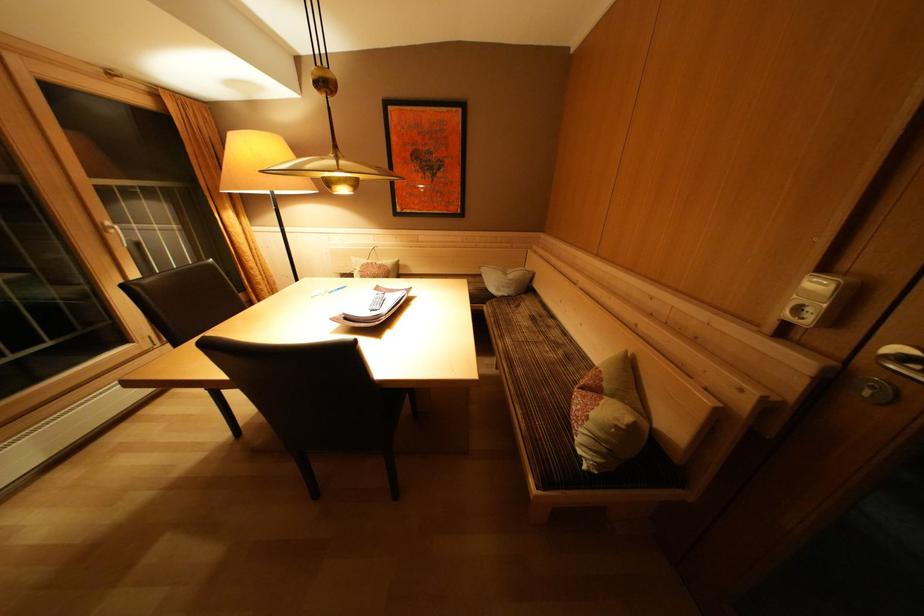
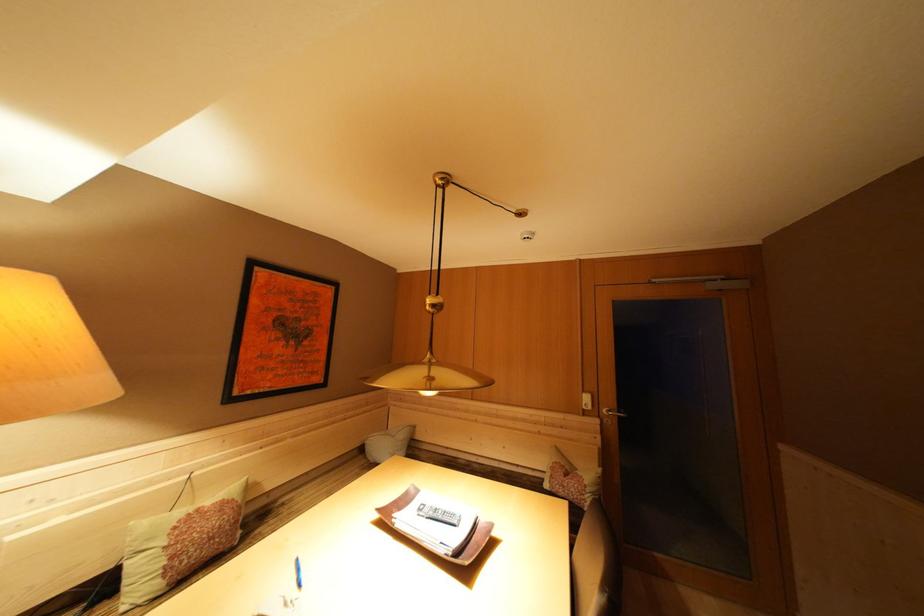
The point at (517, 281) is marked in the first image. Where is the corresponding point in the second image?

(408, 440)